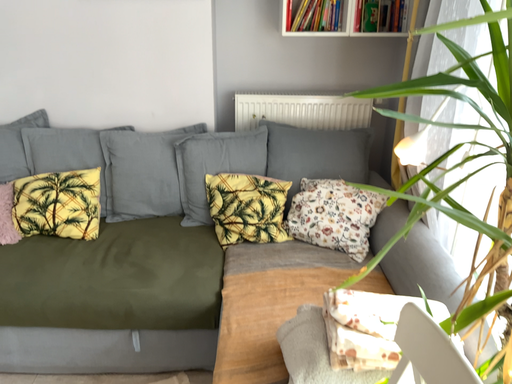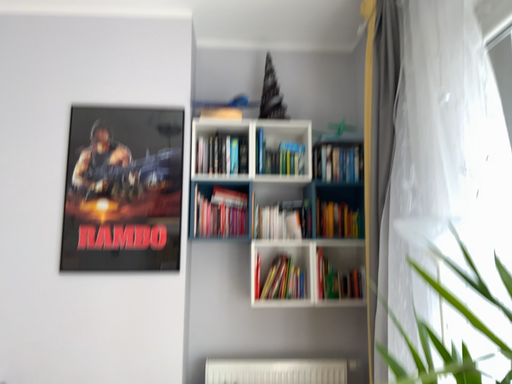
Question: Which way did the camera rotate in the video?

Choices:
 (A) rotated upward
 (B) rotated downward

Answer: (A)